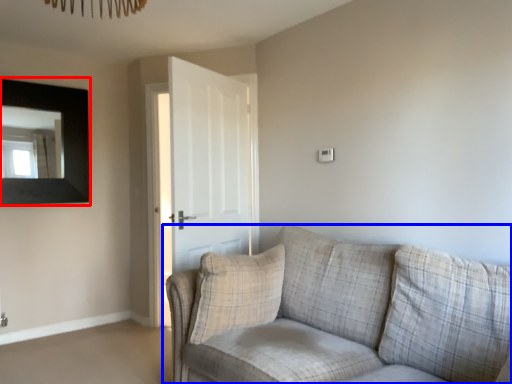
Question: Which of the following is the farthest to the observer, picture frame (highlighted by a red box) or studio couch (highlighted by a blue box)?

Choices:
 (A) picture frame
 (B) studio couch

Answer: (A)